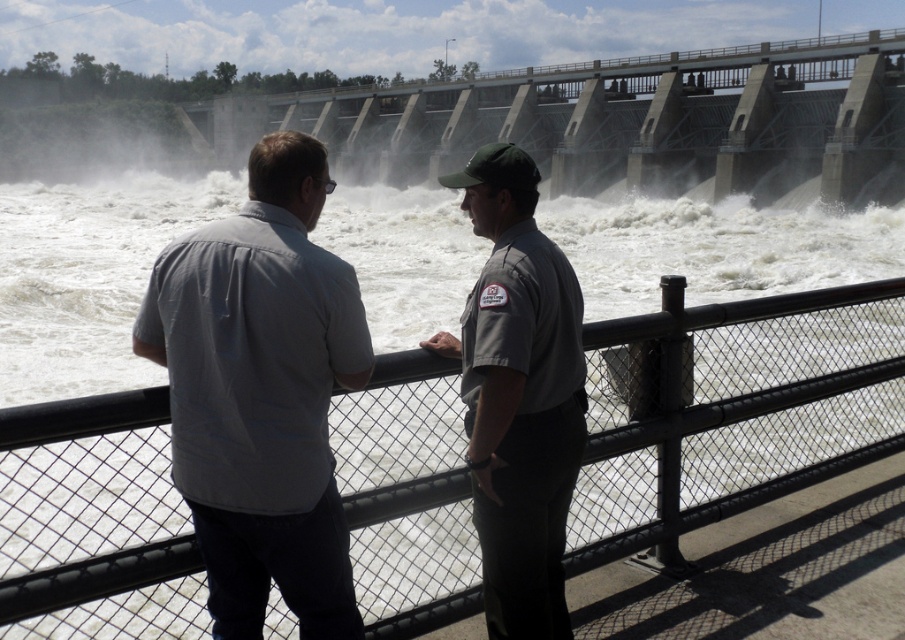
Question: Which of the following is the closest to the observer?

Choices:
 (A) black chain-link fence at center
 (B) concrete dam at center
 (C) gray cotton shirt at center

Answer: (A)

Question: Does black chain-link fence at center appear on the left side of gray cotton shirt at center?

Choices:
 (A) no
 (B) yes

Answer: (A)

Question: Which object is farther from the camera taking this photo?

Choices:
 (A) concrete dam at center
 (B) black chain-link fence at center
 (C) gray cotton shirt at center

Answer: (A)

Question: Is black chain-link fence at center bigger than gray cotton shirt at center?

Choices:
 (A) yes
 (B) no

Answer: (A)

Question: Can you confirm if black chain-link fence at center is positioned to the right of gray uniform at center?

Choices:
 (A) no
 (B) yes

Answer: (B)

Question: Among these objects, which one is nearest to the camera?

Choices:
 (A) concrete dam at center
 (B) gray uniform at center

Answer: (B)